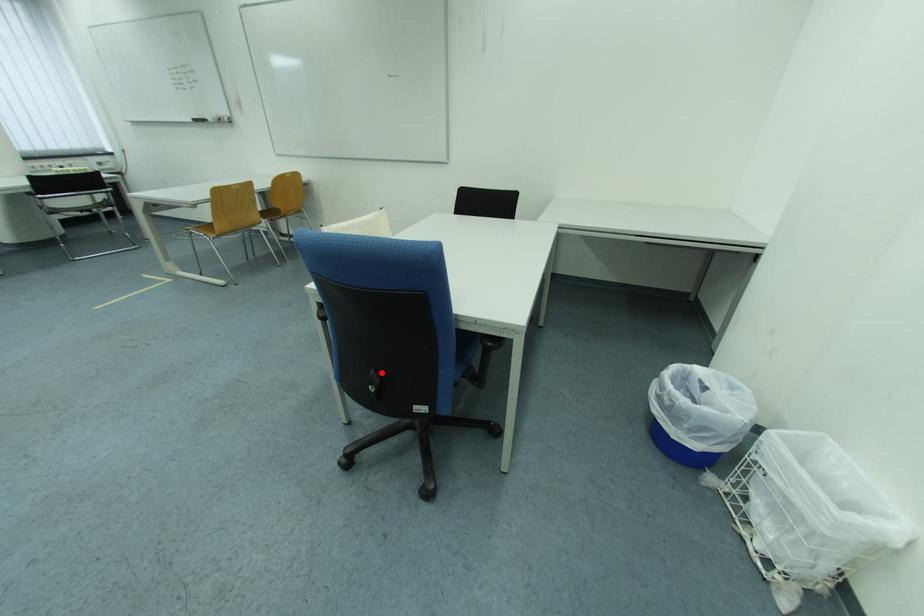
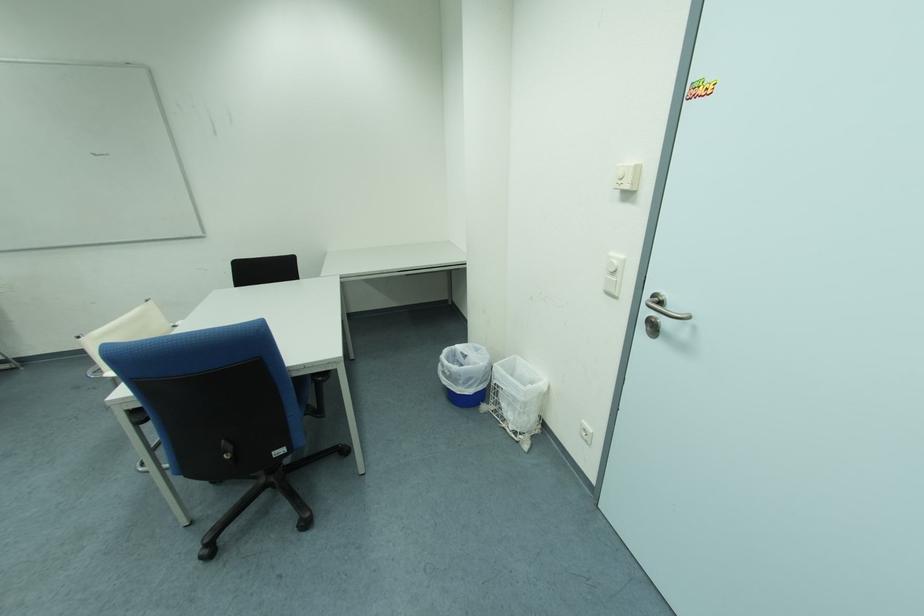
The point at the highlighted location is marked in the first image. Where is the corresponding point in the second image?

(232, 444)